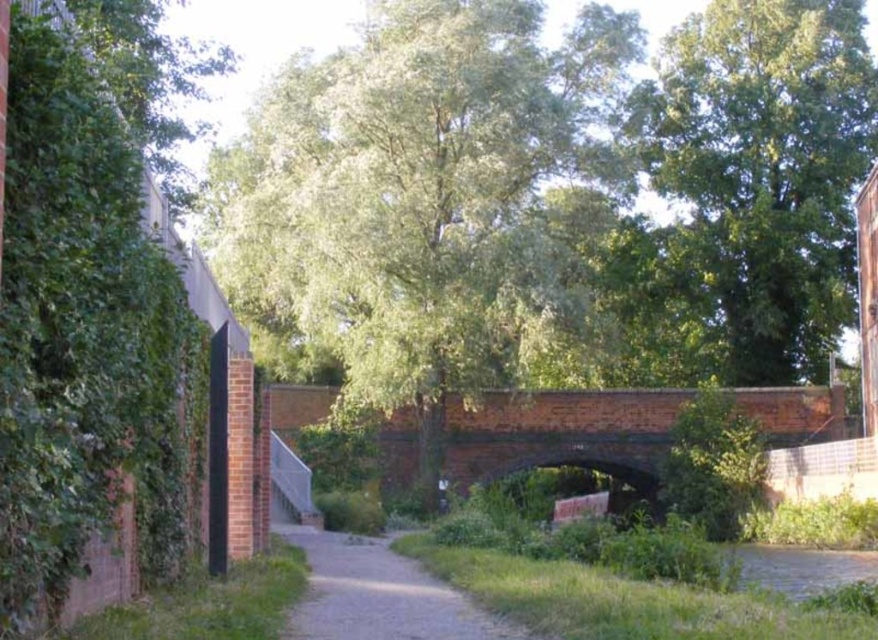
Question: Which object is farther from the camera taking this photo?

Choices:
 (A) green leafy tree at center
 (B) green leafy tree at upper center

Answer: (B)

Question: Can you confirm if green leafy tree at upper center is thinner than brick bridge at center?

Choices:
 (A) no
 (B) yes

Answer: (B)

Question: Is brick bridge at center in front of dirt/gravel path at center?

Choices:
 (A) no
 (B) yes

Answer: (A)

Question: Which object is closer to the camera taking this photo?

Choices:
 (A) brick bridge at center
 (B) green leafy tree at center

Answer: (B)

Question: Which object appears farthest from the camera in this image?

Choices:
 (A) green leafy tree at center
 (B) green leafy tree at upper center

Answer: (B)

Question: Can you confirm if green leafy tree at center is positioned below green leafy tree at upper center?

Choices:
 (A) yes
 (B) no

Answer: (A)